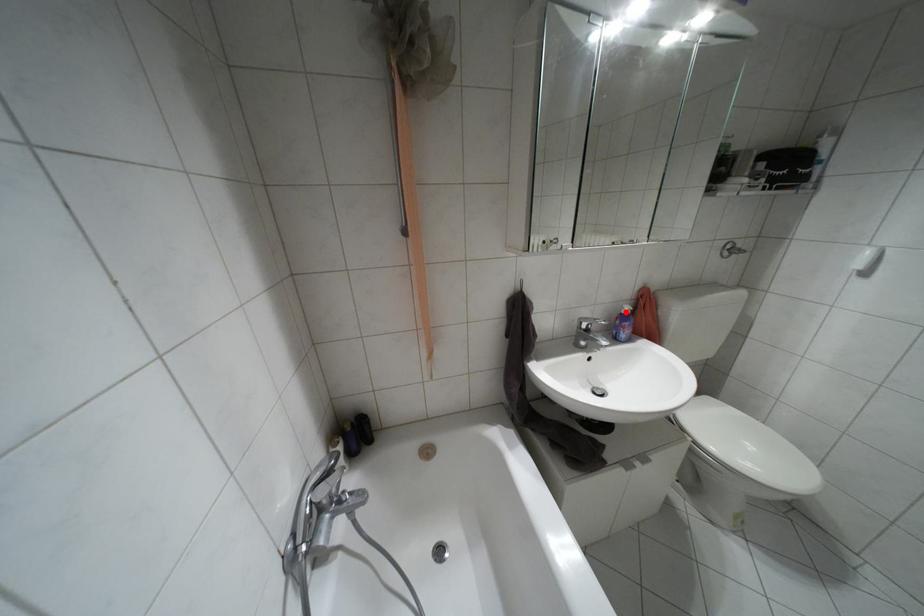
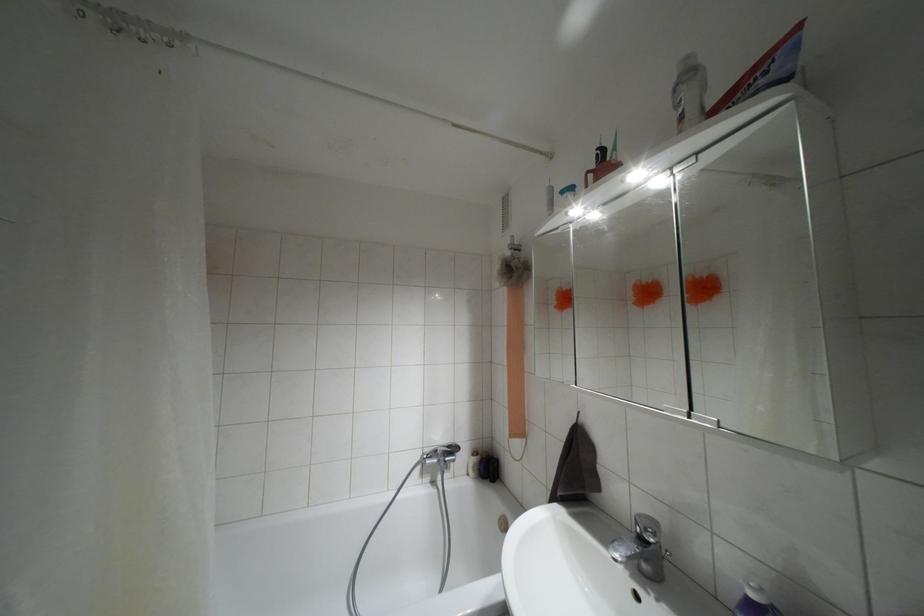
Locate, in the second image, the point that corresponds to the highlighted location in the first image.

(751, 594)